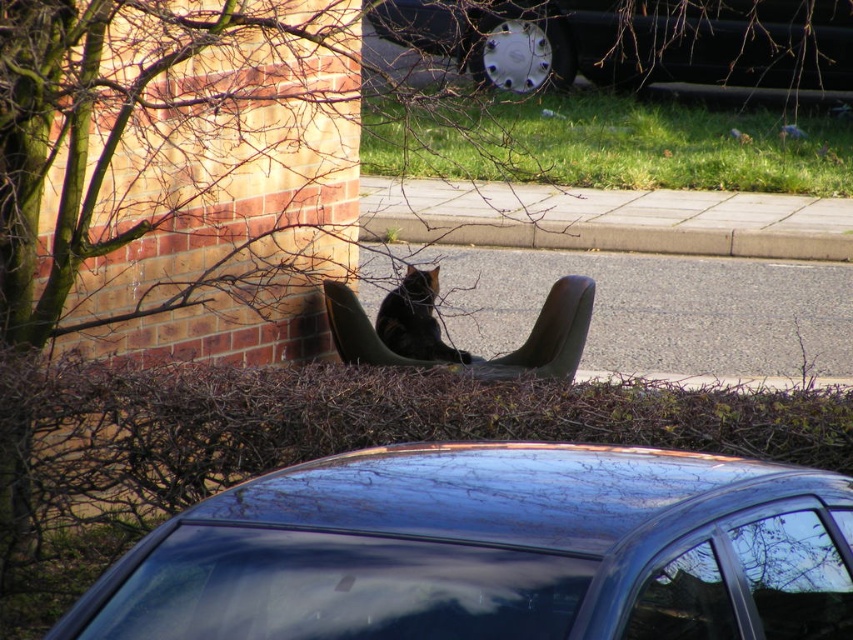
You are standing in the middle of the road and see two points in the scene. Which point is closer to you, point (553, 348) or point (422, 301)?

Point (553, 348) is closer to you than point (422, 301) because it is further to the viewer.

In the scene shown: You are standing at the center of the image and want to locate the shiny black car at center. Which direction should you look to find it?

The shiny black car at center is located at point coordinates of [630,40], so you should look towards the lower left direction from the center to find it.

You are a delivery person trying to deliver a package to the shiny black car at center. The cat on the black fur cat at center is blocking the entrance. Can the delivery person reach the car without moving the cat?

The shiny black car at center is taller than the black fur cat at center, so the delivery person can reach the car without moving the cat by going around or over the cat since the car is taller.